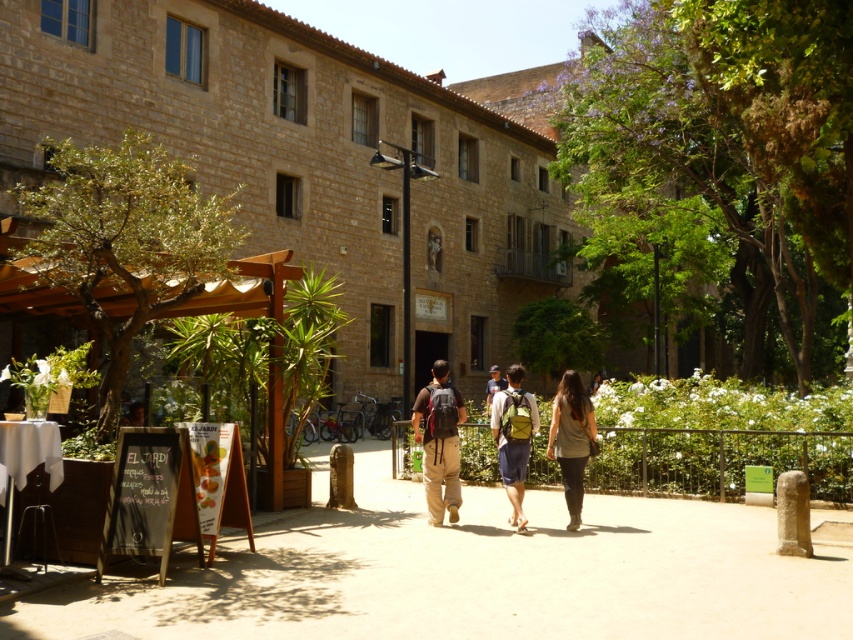
You are a tour guide leading a group and notice two backpacks left on a walkway in the courtyard. The backpacks are the matte brown backpack at center and the green fabric backpack at center. You need to retrieve them but want to ensure you have enough space. If your arms can reach 28 inches, can you pick up both backpacks at the same time without moving them?

The matte brown backpack at center is 26.74 inches from the green fabric backpack at center. Since your arms can reach 28 inches, you can pick up both backpacks at the same time without moving them because the distance between them is within your reach.

What color is the fabric located at point (572, 440) in the image?

The fabric at point (572, 440) is dark olive green.